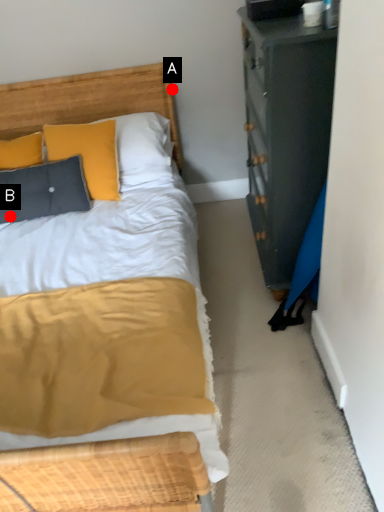
Question: Two points are circled on the image, labeled by A and B beside each circle. Which point is farther to the camera?

Choices:
 (A) A is further
 (B) B is further

Answer: (A)